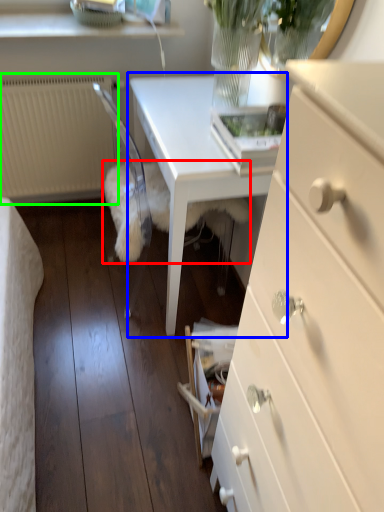
Question: Which object is the farthest from animal (highlighted by a red box)? Choose among these: table (highlighted by a blue box) or radiator (highlighted by a green box).

Choices:
 (A) table
 (B) radiator

Answer: (B)